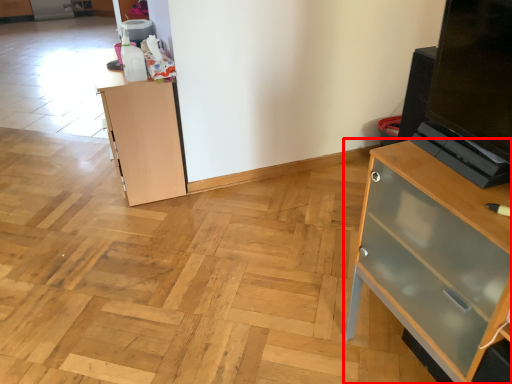
Question: From the image's perspective, what is the correct spatial positioning of chest of drawers (annotated by the red box) in reference to cupboard?

Choices:
 (A) above
 (B) below

Answer: (B)